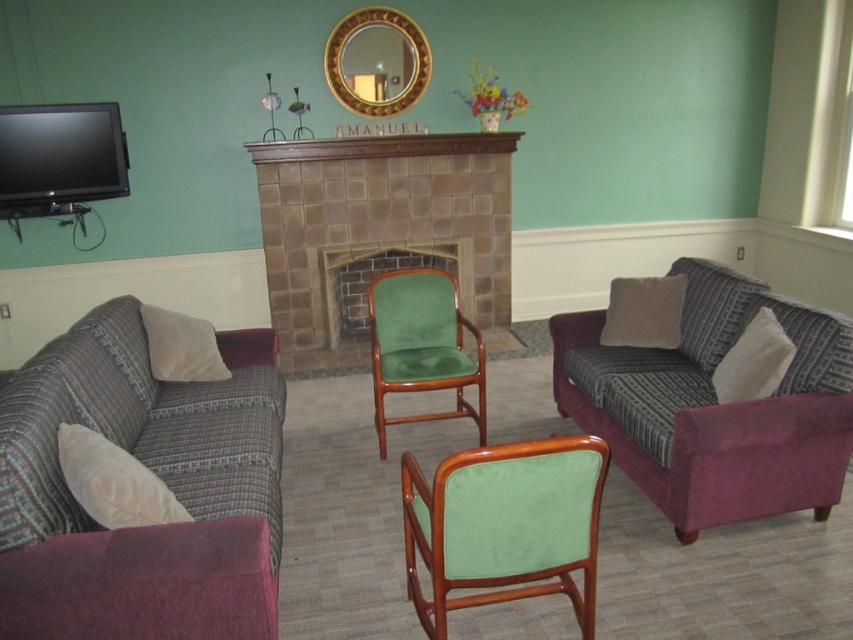
Question: Which point appears farthest from the camera in this image?

Choices:
 (A) (256, 438)
 (B) (432, 380)
 (C) (270, 236)
 (D) (850, 337)

Answer: (C)

Question: Can you confirm if brown tile fireplace at center is wider than green velvet chair at center?

Choices:
 (A) yes
 (B) no

Answer: (A)

Question: Can you confirm if plush purple couch at right is thinner than green suede chair at center?

Choices:
 (A) no
 (B) yes

Answer: (A)

Question: Which object is closer to the camera taking this photo?

Choices:
 (A) green velvet chair at center
 (B) plaid fabric couch at lower left

Answer: (A)

Question: Which object is closer to the camera taking this photo?

Choices:
 (A) green suede chair at center
 (B) plush purple couch at right
 (C) brown tile fireplace at center

Answer: (B)

Question: Does plaid fabric couch at lower left appear on the right side of green suede chair at center?

Choices:
 (A) no
 (B) yes

Answer: (A)